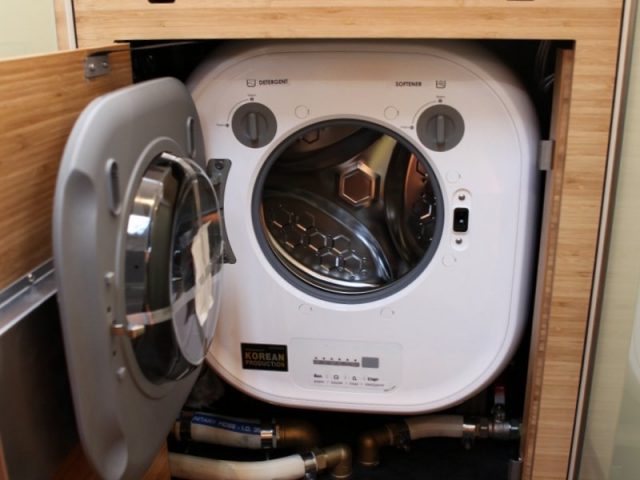
Locate an element on the screen. washing machine dials is located at coordinates click(x=249, y=133), click(x=438, y=124).